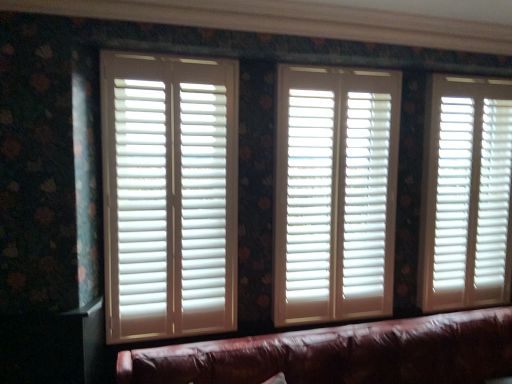
Question: Is white matte wood blinds at center, which ranks as the second window blind in right-to-left order, taller or shorter than white matte blinds at right, which appears as the 1th window blind when viewed from the right?

Choices:
 (A) short
 (B) tall

Answer: (A)

Question: In the image, is white matte wood blinds at center, which ranks as the second window blind in right-to-left order, positioned in front of or behind white matte blinds at right, which appears as the 1th window blind when viewed from the right?

Choices:
 (A) behind
 (B) front

Answer: (B)

Question: Which is nearer to the white matte blinds at left, the first window blind in the left-to-right sequence?

Choices:
 (A) white matte blinds at right, which is the third window blind in left-to-right order
 (B) leather couch at lower center
 (C) white matte wood blinds at center, the second window blind in the left-to-right sequence

Answer: (C)

Question: Estimate the real-world distances between objects in this image. Which object is closer to the white matte blinds at right, which appears as the 1th window blind when viewed from the right?

Choices:
 (A) white matte blinds at left, the first window blind in the left-to-right sequence
 (B) white matte wood blinds at center, the second window blind in the left-to-right sequence
 (C) leather couch at lower center

Answer: (B)